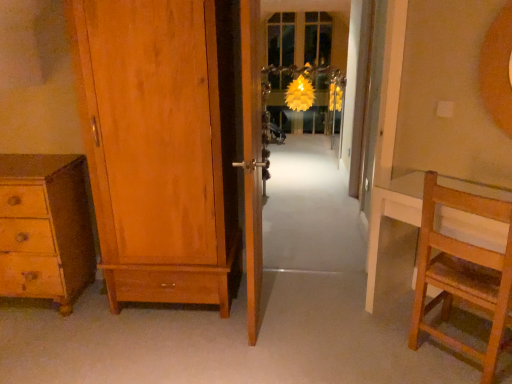
You are a GUI agent. You are given a task and a screenshot of the screen. Output one action in this format:
    pyautogui.click(x=<x>, y=<y>)
    Task: Click on the free point to the right of wooden door at center, the 1th door in the right-to-left sequence
    
    Given the screenshot: What is the action you would take?
    pyautogui.click(x=320, y=312)